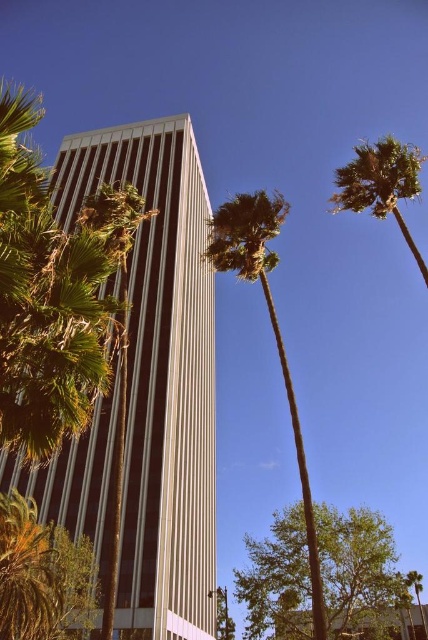
Can you confirm if white striped building at center is thinner than green leafy tree at center?

In fact, white striped building at center might be wider than green leafy tree at center.

Between point (86, 484) and point (279, 586), which one is positioned in front?

Point (279, 586) is more forward.

Where is `white striped building at center`? The image size is (428, 640). white striped building at center is located at coordinates (160, 374).

Can you confirm if green leafy tree at center is shorter than green leafy palm tree at center?

Yes, green leafy tree at center is shorter than green leafy palm tree at center.

Which of these two, green leafy tree at center or green leafy palm tree at center, stands shorter?

With less height is green leafy tree at center.

Which is behind, point (259, 547) or point (255, 237)?

The point (259, 547) is more distant.

Locate an element on the screen. The height and width of the screenshot is (640, 428). green leafy tree at center is located at coordinates (359, 573).

Which of these two, green leafy palm tree at center or green leafy palm tree at upper right, stands shorter?

Standing shorter between the two is green leafy palm tree at center.

This screenshot has width=428, height=640. Describe the element at coordinates (270, 323) in the screenshot. I see `green leafy palm tree at center` at that location.

This screenshot has height=640, width=428. I want to click on green leafy palm tree at center, so click(270, 323).